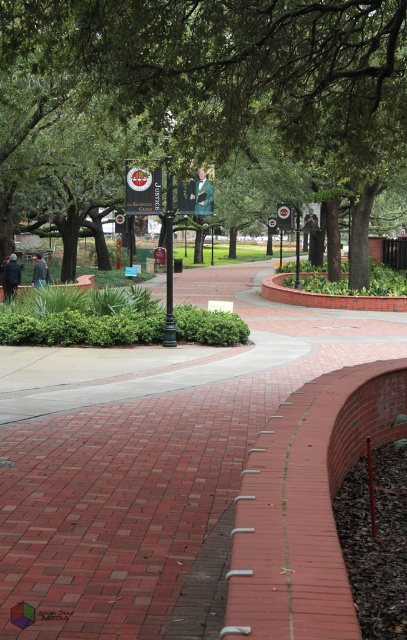
Question: Is red brick pathway at center below green leafy tree at center?

Choices:
 (A) yes
 (B) no

Answer: (A)

Question: Can you confirm if red brick pathway at center is wider than green leafy tree at center?

Choices:
 (A) no
 (B) yes

Answer: (A)

Question: Which point is farther from the camera taking this photo?

Choices:
 (A) (358, 321)
 (B) (19, 154)

Answer: (B)

Question: Among these points, which one is farthest from the camera?

Choices:
 (A) (50, 449)
 (B) (282, 12)

Answer: (B)

Question: Does red brick pathway at center have a larger size compared to green leafy tree at center?

Choices:
 (A) yes
 (B) no

Answer: (B)